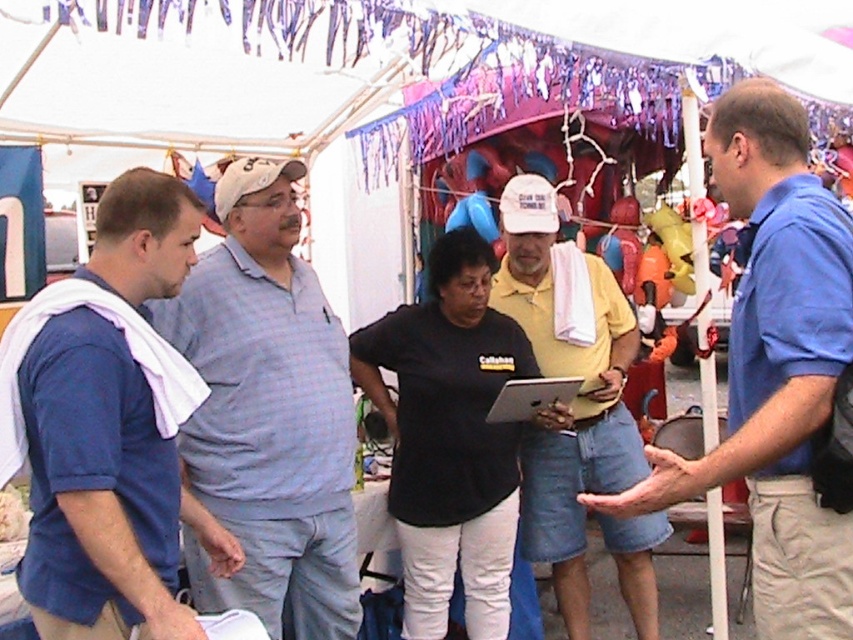
Between blue cotton shirt at right and matte black laptop at center, which one has more height?

With more height is blue cotton shirt at right.

Who is more forward, (843,330) or (561,401)?

Point (843,330)

Who is more forward, [814,508] or [500,404]?

Positioned in front is point [814,508].

The height and width of the screenshot is (640, 853). I want to click on blue cotton shirt at right, so click(x=775, y=368).

Which is in front, point (84, 451) or point (558, 380)?

Point (84, 451) is more forward.

Is blue cotton shirt at left thinner than matte black laptop at center?

Incorrect, blue cotton shirt at left's width is not less than matte black laptop at center's.

Locate an element on the screen. This screenshot has height=640, width=853. blue cotton shirt at left is located at coordinates (108, 426).

Is point (44, 436) positioned in front of point (766, 253)?

Yes, it is.

Between blue cotton shirt at left and blue cotton shirt at right, which one is positioned higher?

blue cotton shirt at right

The width and height of the screenshot is (853, 640). What do you see at coordinates (108, 426) in the screenshot?
I see `blue cotton shirt at left` at bounding box center [108, 426].

Where is `blue cotton shirt at left`? This screenshot has height=640, width=853. blue cotton shirt at left is located at coordinates (108, 426).